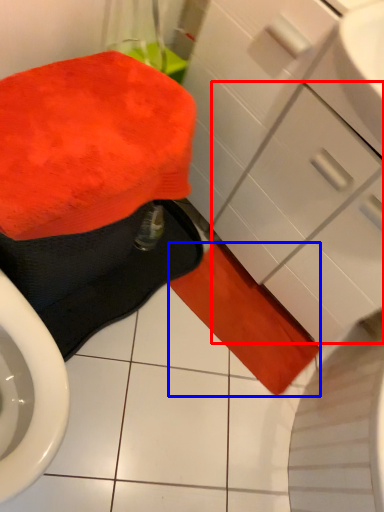
Question: Which object is closer to the camera taking this photo, drawer (highlighted by a red box) or bath towel (highlighted by a blue box)?

Choices:
 (A) drawer
 (B) bath towel

Answer: (A)